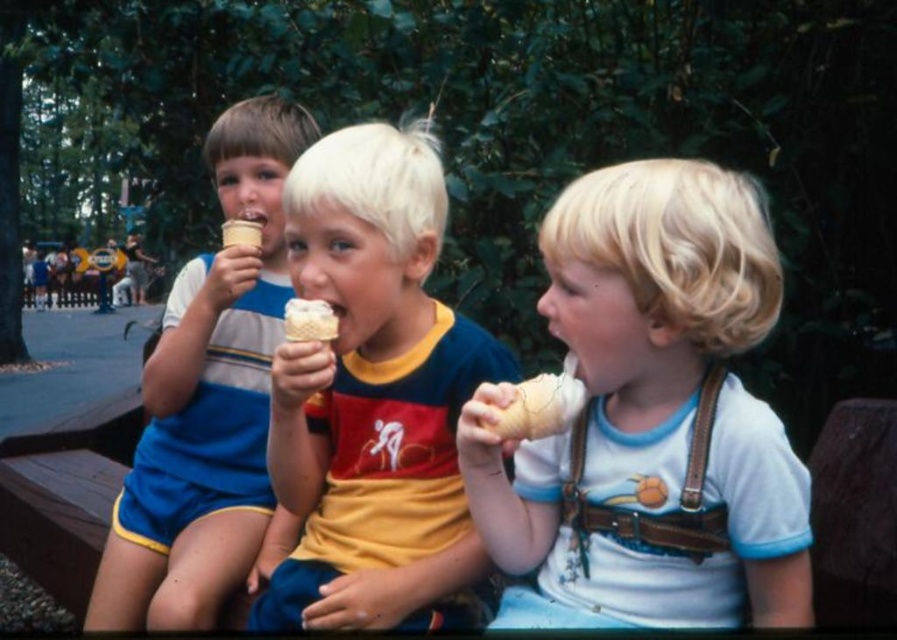
Question: Can you confirm if white matte ice cream cone at center is thinner than matte blue shorts at left?

Choices:
 (A) no
 (B) yes

Answer: (B)

Question: Among these points, which one is farthest from the camera?

Choices:
 (A) (350, 340)
 (B) (163, 344)
 (C) (669, 493)

Answer: (B)

Question: Can you confirm if white matte ice cream cone at center is positioned to the left of matte blue shorts at left?

Choices:
 (A) yes
 (B) no

Answer: (B)

Question: Which object is positioned farthest from the yellow cotton shirt at center?

Choices:
 (A) matte blue shorts at left
 (B) white matte ice cream cone at center

Answer: (A)

Question: Which of the following is the closest to the observer?

Choices:
 (A) yellow cotton shirt at center
 (B) white matte ice cream cone at center
 (C) matte blue shorts at left

Answer: (B)

Question: Does white matte ice cream cone at center appear on the left side of matte blue shorts at left?

Choices:
 (A) no
 (B) yes

Answer: (A)